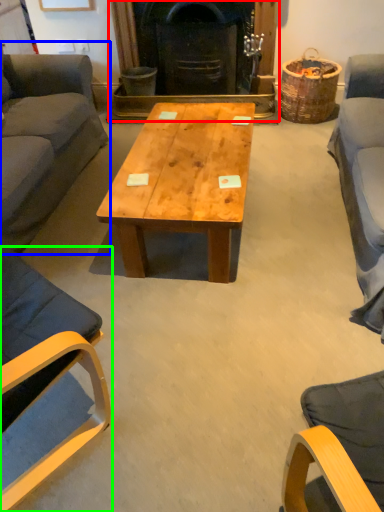
Question: Considering the real-world distances, which object is closest to fireplace (highlighted by a red box)? studio couch (highlighted by a blue box) or chair (highlighted by a green box).

Choices:
 (A) studio couch
 (B) chair

Answer: (A)